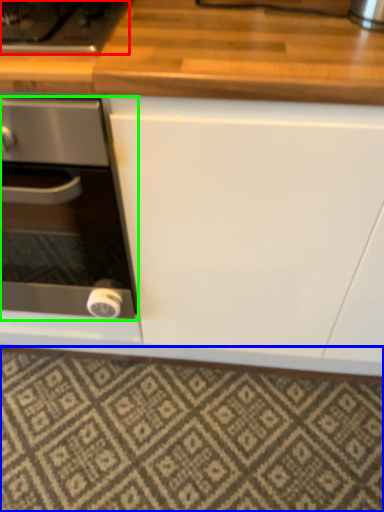
Question: Considering the real-world distances, which object is farthest from gas stove (highlighted by a red box)? tile (highlighted by a blue box) or kitchen appliance (highlighted by a green box)?

Choices:
 (A) tile
 (B) kitchen appliance

Answer: (A)